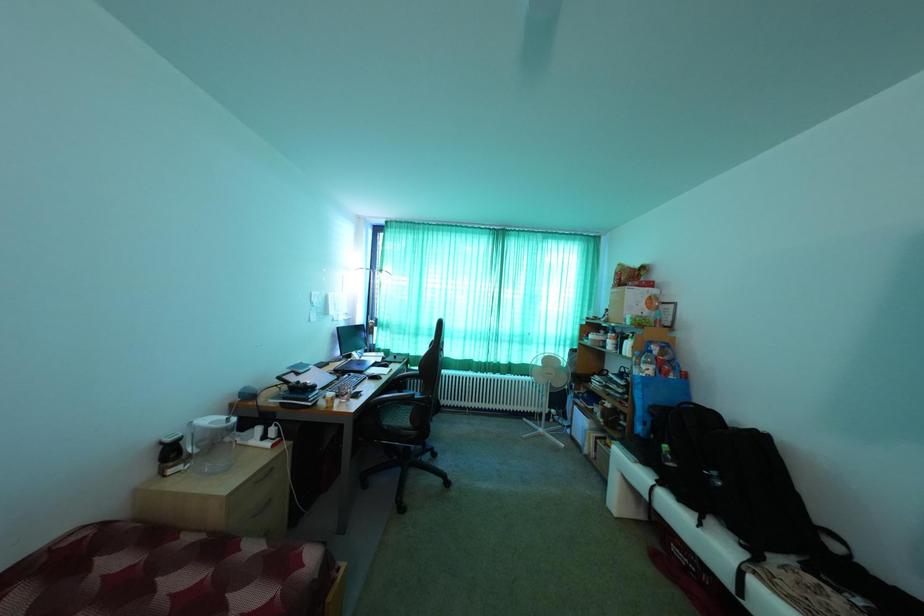
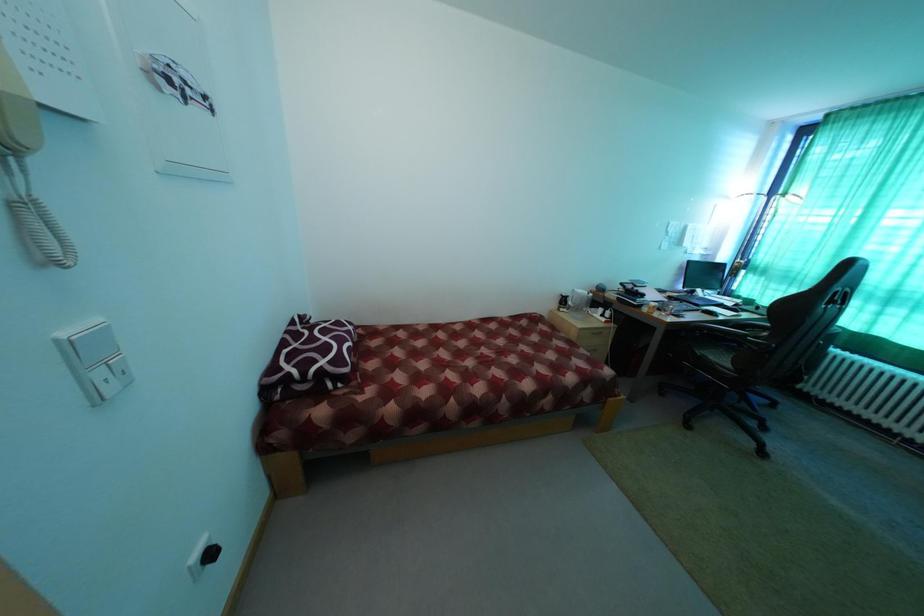
The first image is from the beginning of the video and the second image is from the end. How did the camera likely rotate when shooting the video?

The camera rotated toward left-down.